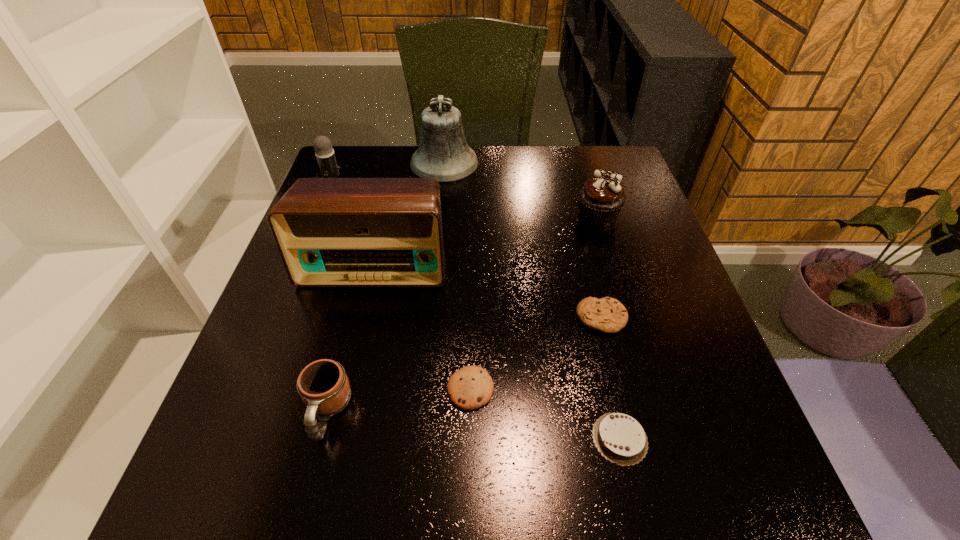
You are a GUI agent. You are given a task and a screenshot of the screen. Output one action in this format:
    pyautogui.click(x=<x>, y=<y>)
    Task: Click on the chocolate cake
    The width and height of the screenshot is (960, 540).
    Given the screenshot: What is the action you would take?
    pyautogui.click(x=620, y=438)

Identify the location of free region located 0.050m on the left of the bell. Image resolution: width=960 pixels, height=540 pixels. (393, 163).

This screenshot has width=960, height=540. In order to click on vacant region located on the front-facing side of the radio receiver in this screenshot , I will do `click(357, 339)`.

Locate an element on the screen. free space located on the front of the seventh nearest object is located at coordinates (284, 318).

The image size is (960, 540). Find the location of `vacant region located 0.070m on the front of the sixth nearest object`. vacant region located 0.070m on the front of the sixth nearest object is located at coordinates (608, 249).

This screenshot has height=540, width=960. In order to click on free spot located on the side of the mug with the handle in this screenshot , I will do `click(304, 502)`.

Identify the location of blank area located on the left of the fourth nearest object. This screenshot has height=540, width=960. (541, 318).

The image size is (960, 540). I want to click on free spot located 0.160m on the back of the left cookie, so coord(472,301).

Find the location of a particular element. free spot located 0.050m on the front of the chocolate cake is located at coordinates coord(634,502).

Locate an element on the screen. The height and width of the screenshot is (540, 960). bell situated at the far edge is located at coordinates (444, 154).